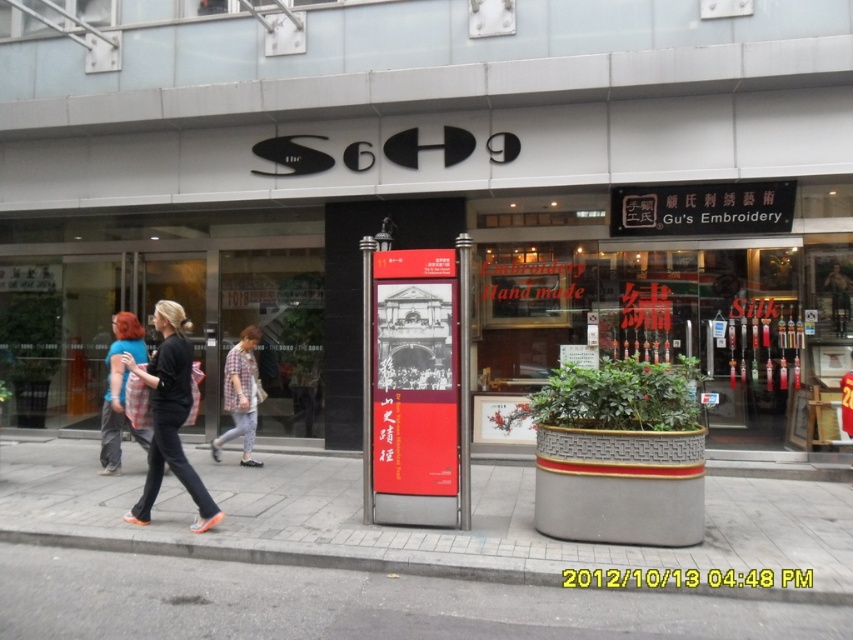
From the picture: Is gray asphalt pavement at lower center above black matte pants at center?

No.

Is gray asphalt pavement at lower center further to the viewer compared to black matte pants at center?

No, gray asphalt pavement at lower center is in front of black matte pants at center.

This screenshot has width=853, height=640. Find the location of `gray asphalt pavement at lower center`. gray asphalt pavement at lower center is located at coordinates (354, 604).

Which is behind, point (178, 451) or point (247, 449)?

The point (247, 449) is behind.

Looking at this image, is black matte pants at center positioned before plaid fabric shirt at center?

Yes, it is in front of plaid fabric shirt at center.

Is point (131, 368) farther from camera compared to point (247, 387)?

That is False.

This screenshot has height=640, width=853. What are the coordinates of `black matte pants at center` in the screenshot? It's located at (169, 416).

Can you confirm if gray concrete pavement at center is bigger than black matte pants at center?

Actually, gray concrete pavement at center might be smaller than black matte pants at center.

Between gray concrete pavement at center and black matte pants at center, which one appears on the right side from the viewer's perspective?

gray concrete pavement at center

Describe the element at coordinates (409, 528) in the screenshot. I see `gray concrete pavement at center` at that location.

Where is `gray concrete pavement at center`? gray concrete pavement at center is located at coordinates (409, 528).